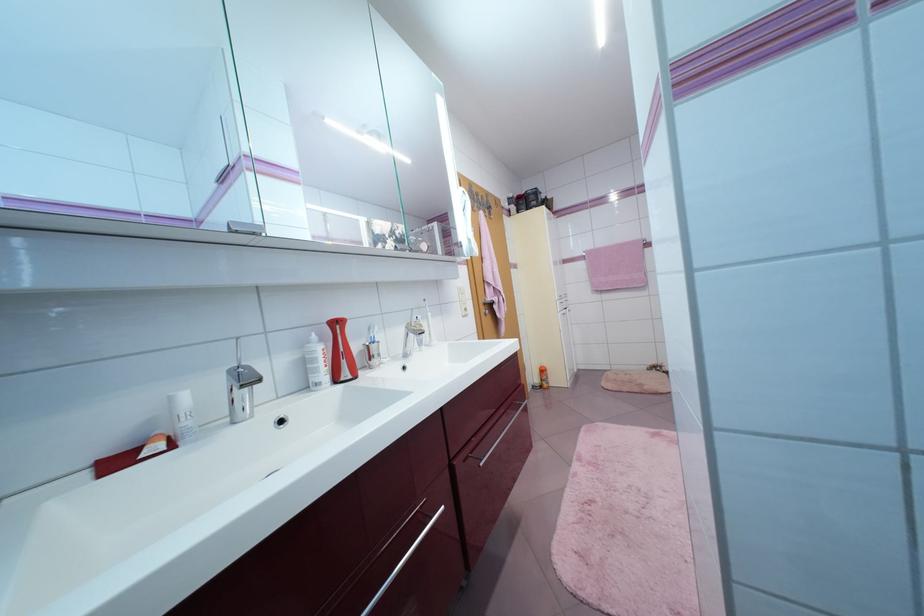
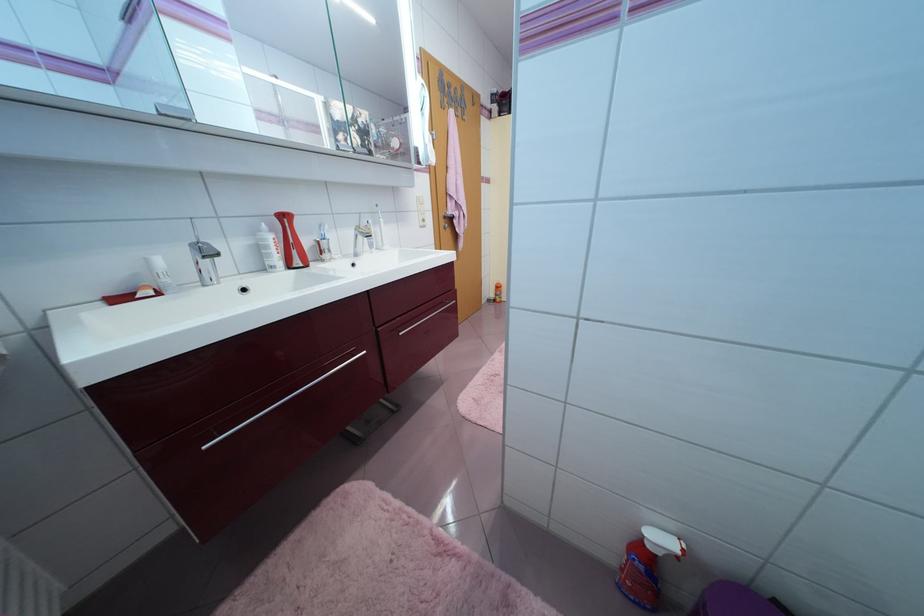
In the second image, find the point that corresponds to pixel 417 337 in the first image.

(365, 238)